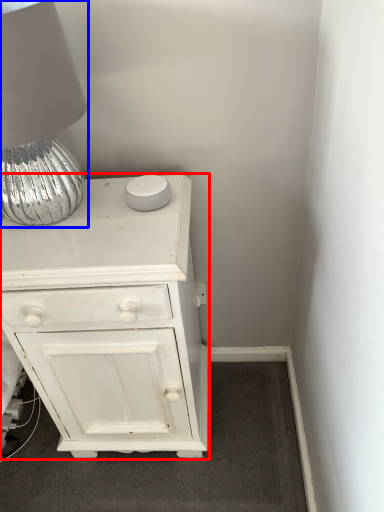
Question: Which object is further to the camera taking this photo, chest of drawers (highlighted by a red box) or table lamp (highlighted by a blue box)?

Choices:
 (A) chest of drawers
 (B) table lamp

Answer: (A)